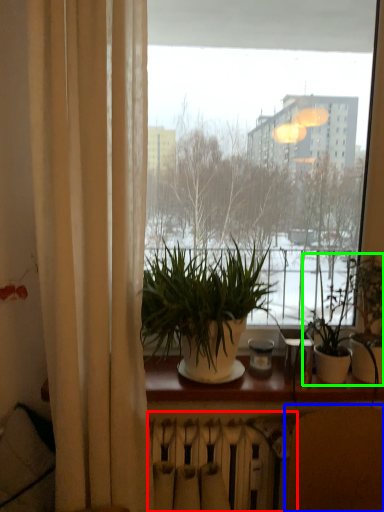
Question: Estimate the real-world distances between objects in this image. Which object is farther from radiator (highlighted by a red box), armchair (highlighted by a blue box) or houseplant (highlighted by a green box)?

Choices:
 (A) armchair
 (B) houseplant

Answer: (B)